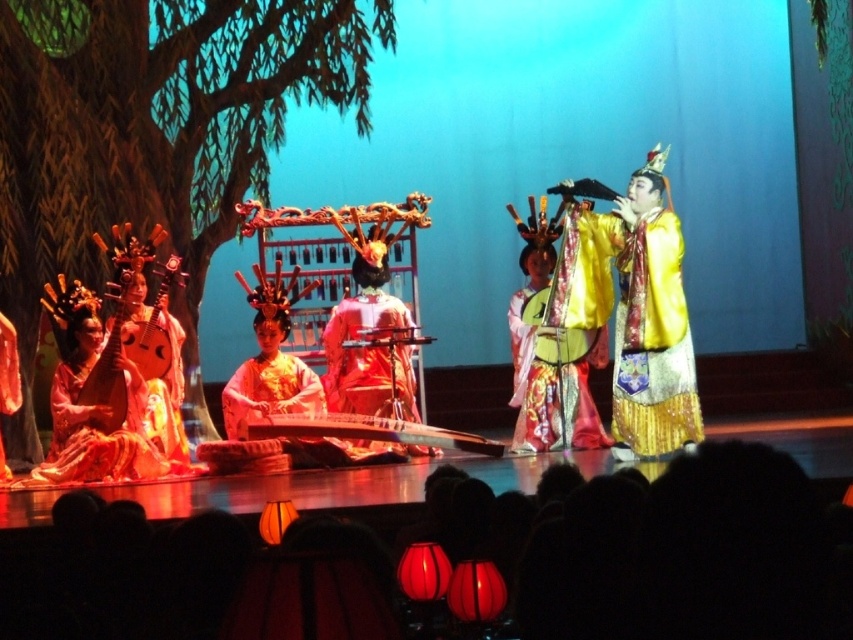
Question: Does wooden stringed instrument at center appear on the right side of matte gold lute at left?

Choices:
 (A) no
 (B) yes

Answer: (B)

Question: Which object appears farthest from the camera in this image?

Choices:
 (A) wooden stringed instrument at center
 (B) shiny gold dress at lower left
 (C) silk embroidered robe at center
 (D) silky gold robe at center

Answer: (D)

Question: Does silky gold robe at center come in front of wooden stringed instrument at center?

Choices:
 (A) no
 (B) yes

Answer: (A)

Question: Estimate the real-world distances between objects in this image. Which object is farther from the matte gold lute at left?

Choices:
 (A) yellow satin robe at right
 (B) wooden stringed instrument at center
 (C) shiny gold dress at lower left
 (D) silk embroidered robe at center

Answer: (A)

Question: Which object is closer to the camera taking this photo?

Choices:
 (A) wooden stringed instrument at center
 (B) silky gold robe at center

Answer: (A)

Question: Does shiny gold dress at lower left lie behind matte gold lute at left?

Choices:
 (A) yes
 (B) no

Answer: (B)